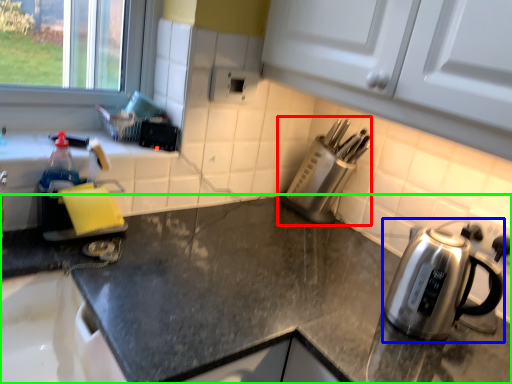
Question: Which object is the closest to the appliance (highlighted by a red box)? Choose among these: kettle (highlighted by a blue box) or countertop (highlighted by a green box).

Choices:
 (A) kettle
 (B) countertop

Answer: (A)